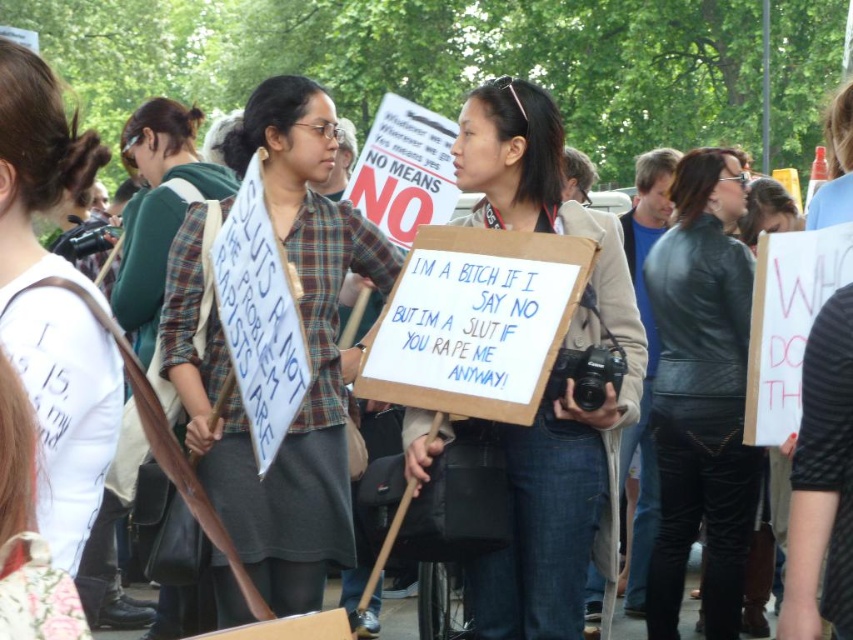
Can you confirm if cardboard sign at center is positioned to the left of green plaid shirt at upper left?

In fact, cardboard sign at center is to the right of green plaid shirt at upper left.

Is cardboard sign at center below green plaid shirt at upper left?

Yes.

Between point (521, 632) and point (131, 243), which one is positioned behind?

The point (131, 243) is more distant.

You are a GUI agent. You are given a task and a screenshot of the screen. Output one action in this format:
    pyautogui.click(x=<x>, y=<y>)
    Task: Click on the cardboard sign at center
    
    Given the screenshot: What is the action you would take?
    pyautogui.click(x=550, y=378)

Which is in front, point (306, 506) or point (724, 428)?

Point (306, 506) is more forward.

This screenshot has height=640, width=853. Describe the element at coordinates (306, 348) in the screenshot. I see `plaid shirt at center` at that location.

Locate an element on the screen. The width and height of the screenshot is (853, 640). plaid shirt at center is located at coordinates (306, 348).

Who is lower down, plaid shirt at center or cardboard sign at center?

cardboard sign at center

Who is more distant from viewer, (248, 152) or (514, 116)?

Point (248, 152)

Find the location of a particular element. The height and width of the screenshot is (640, 853). plaid shirt at center is located at coordinates (306, 348).